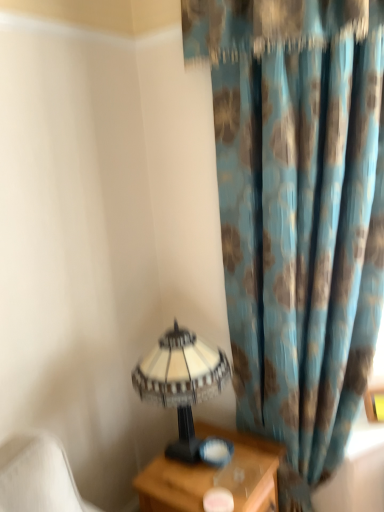
Question: In terms of size, does blue floral fabric curtain at right appear bigger or smaller than wooden nightstand at lower right?

Choices:
 (A) small
 (B) big

Answer: (B)

Question: In terms of width, does blue floral fabric curtain at right look wider or thinner when compared to wooden nightstand at lower right?

Choices:
 (A) wide
 (B) thin

Answer: (A)

Question: Which object is positioned closest to the wooden nightstand at lower right?

Choices:
 (A) yellow matte picture frame at right
 (B) blue floral fabric curtain at right
 (C) white textured lampshade at lower left

Answer: (C)

Question: Which is nearer to the yellow matte picture frame at right?

Choices:
 (A) wooden nightstand at lower right
 (B) white textured lampshade at lower left
 (C) blue floral fabric curtain at right

Answer: (A)